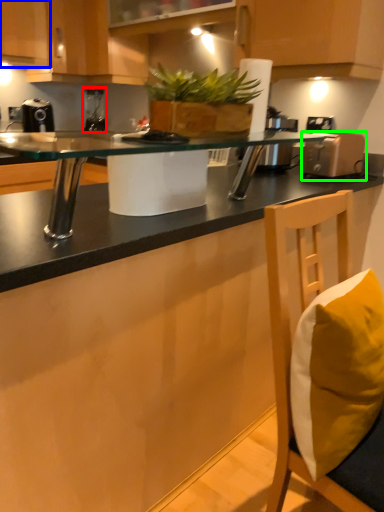
Question: Which object is the closest to the coffee machine (highlighted by a red box)? Choose among these: cabinetry (highlighted by a blue box) or appliance (highlighted by a green box).

Choices:
 (A) cabinetry
 (B) appliance

Answer: (A)